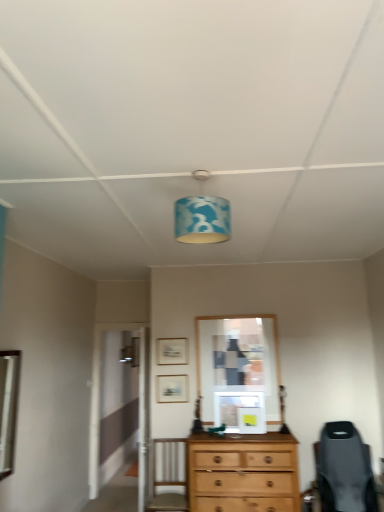
Question: Is matte wooden picture frame at center, which is counted as the 2th picture frame, starting from the top, in front of or behind matte gold picture frame at center, the first picture frame from the top, in the image?

Choices:
 (A) behind
 (B) front

Answer: (B)

Question: Considering the positions of matte wooden picture frame at center, which is counted as the 2th picture frame, starting from the top, and matte gold picture frame at center, which is counted as the 2th picture frame, starting from the bottom, in the image, is matte wooden picture frame at center, which is counted as the 2th picture frame, starting from the top, bigger or smaller than matte gold picture frame at center, which is counted as the 2th picture frame, starting from the bottom,?

Choices:
 (A) small
 (B) big

Answer: (B)

Question: Estimate the real-world distances between objects in this image. Which object is closer to the blue fabric lampshade at center?

Choices:
 (A) matte gold picture frame at center, the first picture frame from the top
 (B) matte wooden picture frame at center, which is the first picture frame in bottom-to-top order
 (C) silver metallic mirror at left

Answer: (C)

Question: Which of these objects is positioned closest to the blue fabric lampshade at center?

Choices:
 (A) matte wooden picture frame at center, which is counted as the 2th picture frame, starting from the top
 (B) matte gold picture frame at center, the first picture frame from the top
 (C) silver metallic mirror at left

Answer: (C)